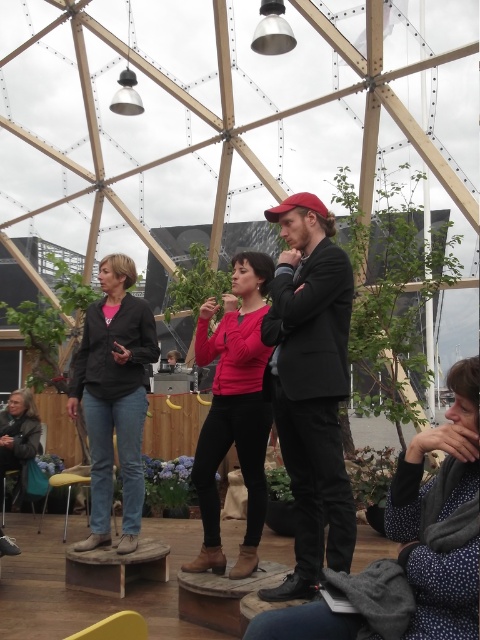
Question: Which object appears closest to the camera in this image?

Choices:
 (A) gray woolen scarf at lower left
 (B) yellow plastic stool at lower center
 (C) denim jacket at center

Answer: (C)

Question: Considering the relative positions of matte black suit at center and pink matte jacket at center in the image provided, where is matte black suit at center located with respect to pink matte jacket at center?

Choices:
 (A) above
 (B) below

Answer: (A)

Question: Which of the following is the farthest from the observer?

Choices:
 (A) (32, 413)
 (B) (96, 477)
 (C) (312, 346)
 (D) (450, 529)

Answer: (A)

Question: Is polka dot dress at center further to camera compared to denim jacket at center?

Choices:
 (A) yes
 (B) no

Answer: (B)

Question: Based on their relative distances, which object is farther from the pink matte jacket at center?

Choices:
 (A) denim jacket at center
 (B) polka dot dress at center
 (C) gray woolen scarf at lower left

Answer: (C)

Question: From the image, what is the correct spatial relationship of polka dot dress at center in relation to gray woolen scarf at lower left?

Choices:
 (A) right
 (B) left

Answer: (A)